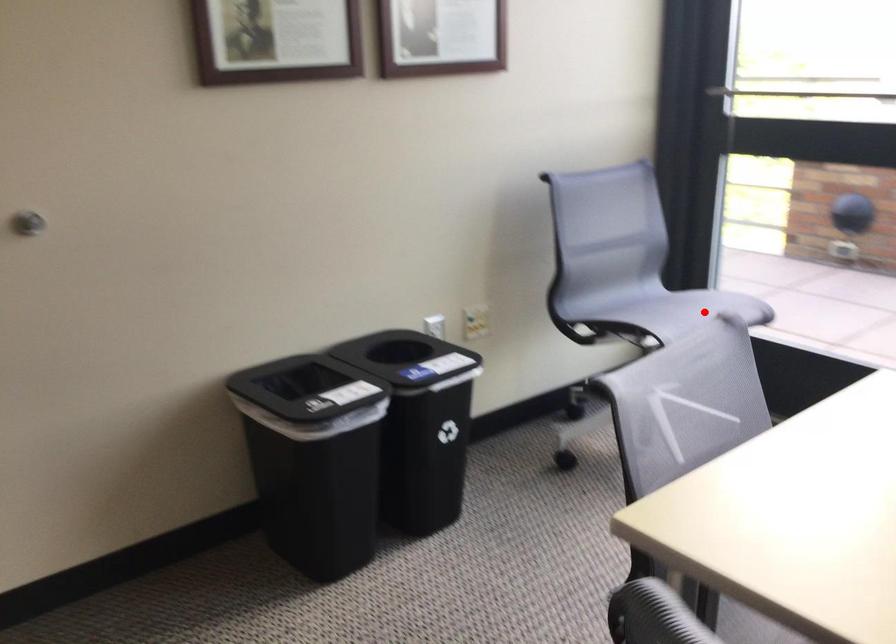
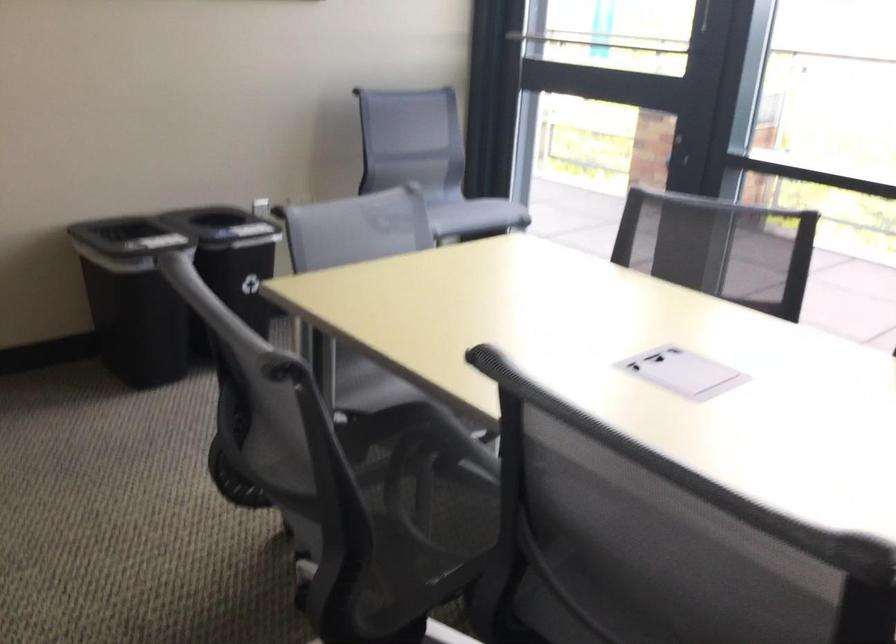
Question: I am providing you with two images of the same scene from different viewpoints. A red point is shown in image1. For the corresponding object point in image2, is it positioned nearer or farther from the camera?

Choices:
 (A) Nearer
 (B) Farther

Answer: (B)